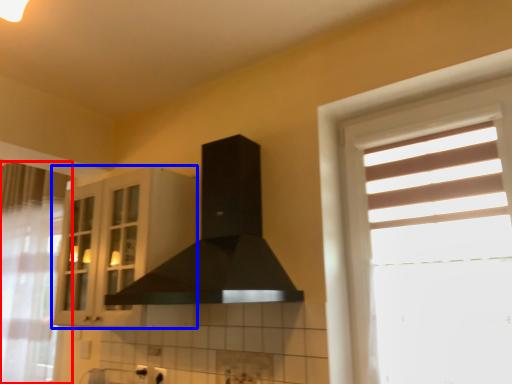
Question: Which of the following is the farthest to the observer, curtain (highlighted by a red box) or cabinetry (highlighted by a blue box)?

Choices:
 (A) curtain
 (B) cabinetry

Answer: (A)